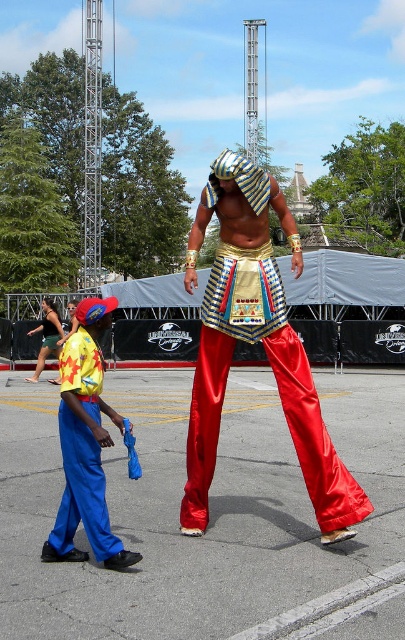
Can you confirm if shiny red pants at center is smaller than blue satin pants at lower left?

No.

Is point (247, 193) farther from viewer compared to point (76, 436)?

Yes, it is.

Where is `shiny red pants at center`? The image size is (405, 640). shiny red pants at center is located at coordinates (255, 340).

Locate an element on the screen. Image resolution: width=405 pixels, height=640 pixels. shiny red pants at center is located at coordinates (255, 340).